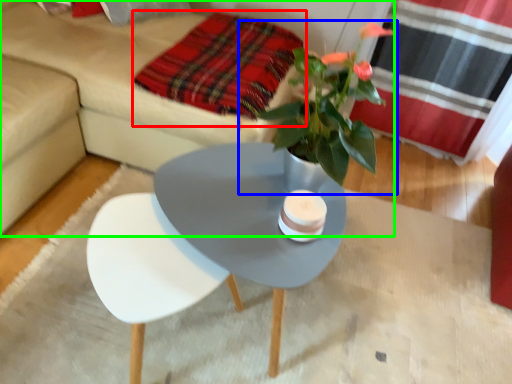
Question: Based on their relative distances, which object is nearer to blanket (highlighted by a red box)? Choose from houseplant (highlighted by a blue box) and studio couch (highlighted by a green box).

Choices:
 (A) houseplant
 (B) studio couch

Answer: (B)